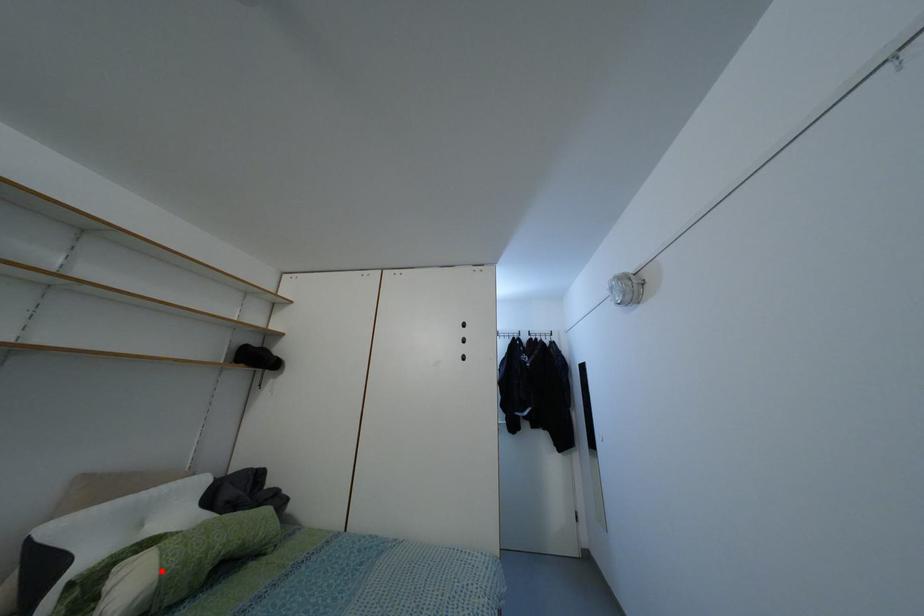
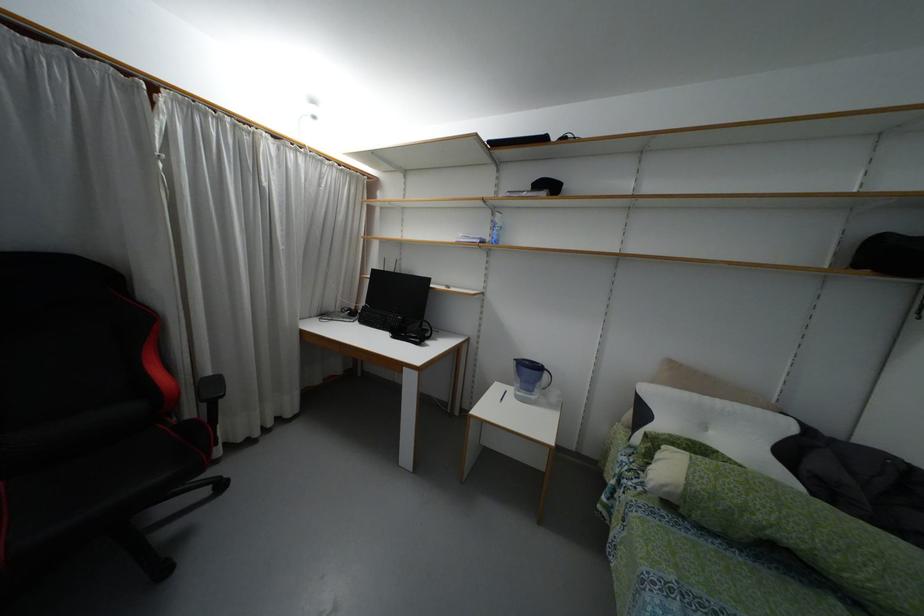
Question: I am providing you with two images of the same scene from different viewpoints. A red point is marked on the first image. At the location where the point appears in image 1, is it still visible in image 2?

Choices:
 (A) Yes
 (B) No

Answer: (A)